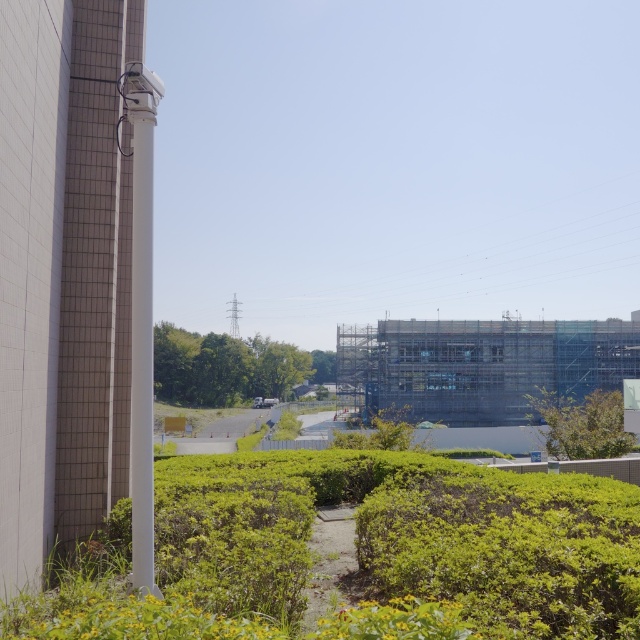
A drone is flying at a point with coordinates point at (596, 616). The drone needs to drop a package at the construction site. If the drone can travel 4 meters before needing to recharge, will it be able to reach the construction site from its current position?

The distance between the drone at point at (596, 616) and the construction site is 4.32 meters. Since the drone can only travel 4 meters before needing to recharge, it will not be able to reach the construction site without recharging first.

You are a landscape architect designing a garden. You have two plants to place in the center of the garden. The green leafy bush at center and the green leafy shrubs at center. Which one should you choose if you want a larger plant in the center?

You should choose the green leafy shrubs at center because it is larger than the green leafy bush at center.